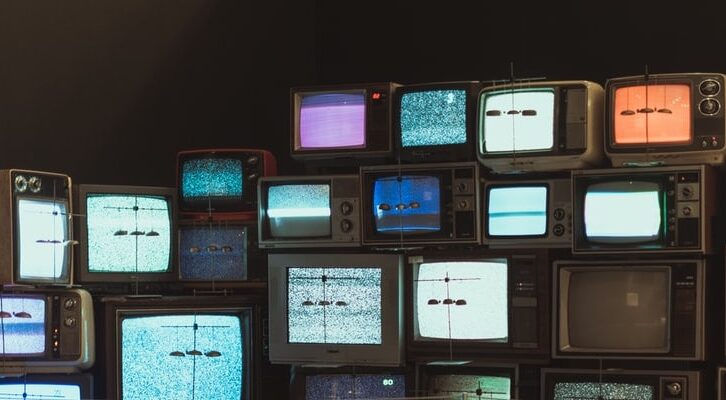
Where is `off tvs`? This screenshot has width=726, height=400. off tvs is located at coordinates (613, 319), (197, 249), (203, 261), (629, 332).